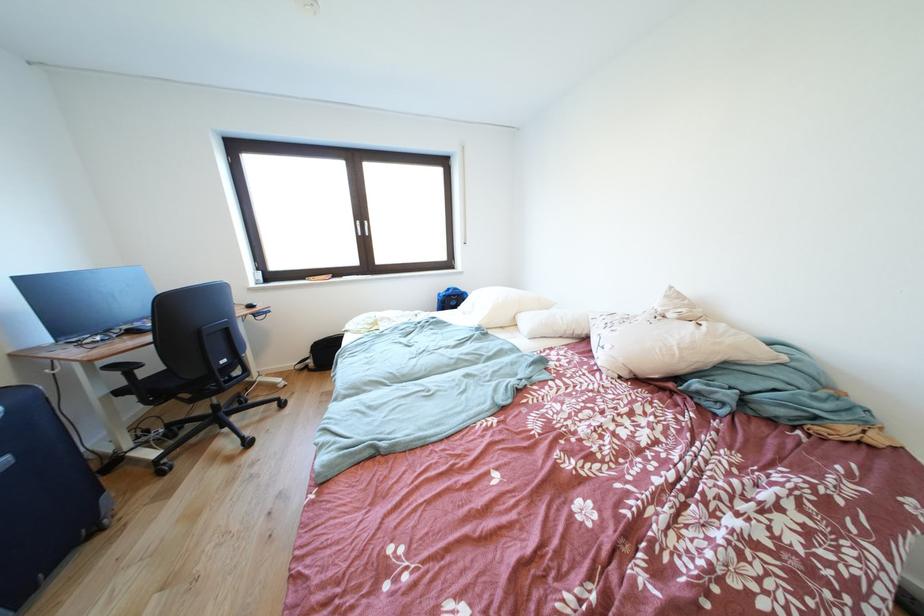
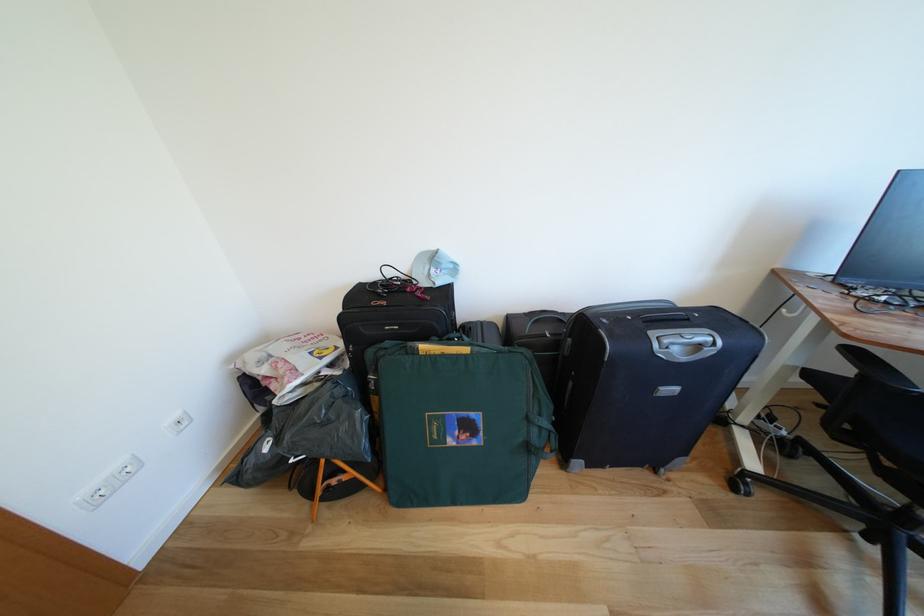
Where in the second image is the point corresponding to the point at 120,371 from the first image?

(862, 357)